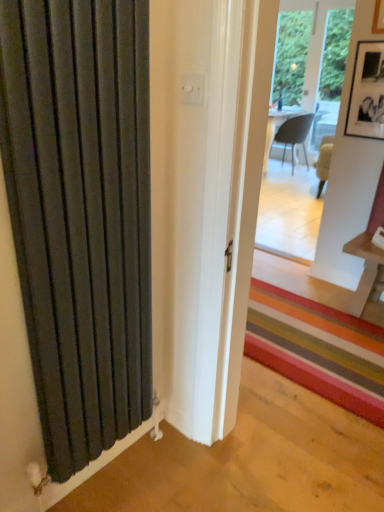
Question: Are matte black radiator at left and matte gray chair at center located far from each other?

Choices:
 (A) yes
 (B) no

Answer: (A)

Question: Considering the relative sizes of matte black radiator at left and matte gray chair at center in the image provided, is matte black radiator at left wider than matte gray chair at center?

Choices:
 (A) no
 (B) yes

Answer: (A)

Question: Does matte black radiator at left have a lesser height compared to matte gray chair at center?

Choices:
 (A) yes
 (B) no

Answer: (B)

Question: Is matte black radiator at left facing away from matte gray chair at center?

Choices:
 (A) no
 (B) yes

Answer: (A)

Question: Would you say matte gray chair at center is part of matte black radiator at left's contents?

Choices:
 (A) no
 (B) yes

Answer: (A)

Question: Does matte black radiator at left appear on the right side of matte gray chair at center?

Choices:
 (A) yes
 (B) no

Answer: (B)

Question: Is matte gray chair at center surrounding matte black radiator at left?

Choices:
 (A) yes
 (B) no

Answer: (B)

Question: Does matte gray chair at center lie in front of matte black radiator at left?

Choices:
 (A) no
 (B) yes

Answer: (A)

Question: Considering the relative positions of matte gray chair at center and matte black radiator at left in the image provided, is matte gray chair at center to the right of matte black radiator at left from the viewer's perspective?

Choices:
 (A) yes
 (B) no

Answer: (A)

Question: From a real-world perspective, is matte gray chair at center positioned under matte black radiator at left based on gravity?

Choices:
 (A) yes
 (B) no

Answer: (A)

Question: Is matte gray chair at center further to camera compared to matte black radiator at left?

Choices:
 (A) yes
 (B) no

Answer: (A)

Question: From the image's perspective, is matte gray chair at center on matte black radiator at left?

Choices:
 (A) yes
 (B) no

Answer: (A)

Question: Can you confirm if black matte picture frame at upper right is wider than matte black radiator at left?

Choices:
 (A) no
 (B) yes

Answer: (A)